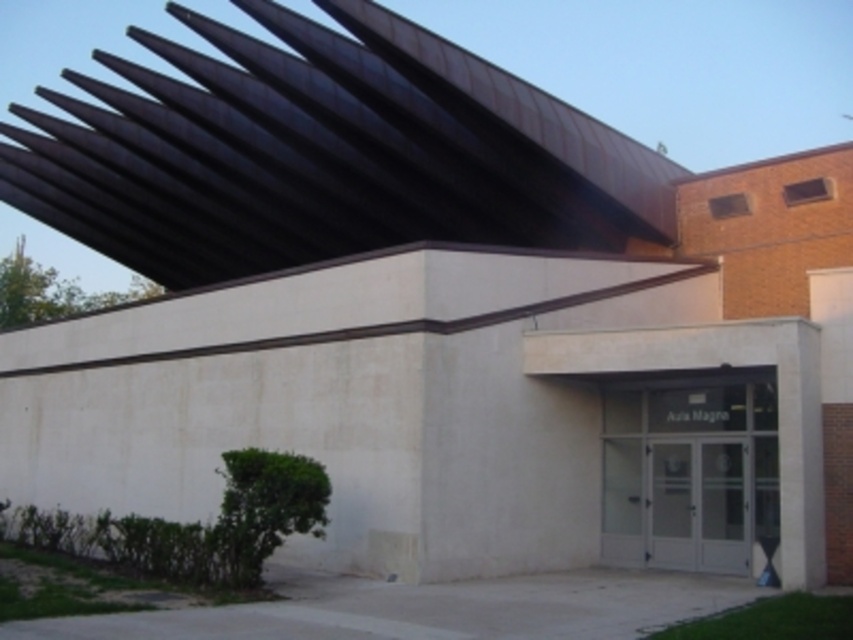
Question: Which point is closer to the camera?

Choices:
 (A) (660, 230)
 (B) (677, 396)

Answer: (B)

Question: Can you confirm if black corrugated metal roof at upper center is positioned above clear glass doors at center?

Choices:
 (A) no
 (B) yes

Answer: (B)

Question: Which of the following is the closest to the observer?

Choices:
 (A) black corrugated metal roof at upper center
 (B) clear glass doors at center

Answer: (B)

Question: Is black corrugated metal roof at upper center closer to camera compared to clear glass doors at center?

Choices:
 (A) no
 (B) yes

Answer: (A)

Question: Considering the relative positions of black corrugated metal roof at upper center and clear glass doors at center in the image provided, where is black corrugated metal roof at upper center located with respect to clear glass doors at center?

Choices:
 (A) right
 (B) left

Answer: (B)